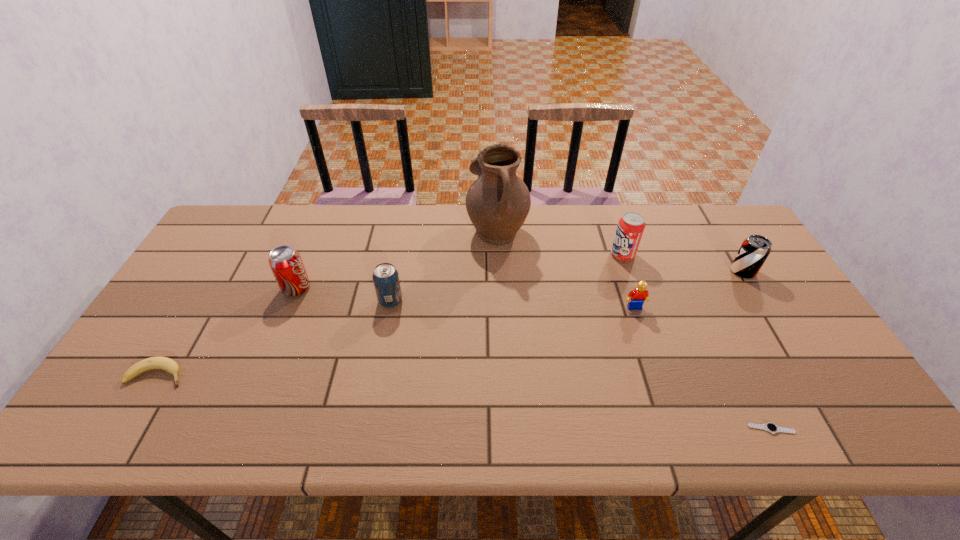
Locate an element on the screen. the shortest object is located at coordinates (770, 427).

Locate an element on the screen. The height and width of the screenshot is (540, 960). free space located 0.130m at the spout of the tallest object is located at coordinates (428, 228).

You are a GUI agent. You are given a task and a screenshot of the screen. Output one action in this format:
    pyautogui.click(x=<x>, y=<y>)
    Task: Click on the free space located at the spout of the tallest object
    This screenshot has width=960, height=540.
    Given the screenshot: What is the action you would take?
    pyautogui.click(x=421, y=228)

The width and height of the screenshot is (960, 540). What are the coordinates of `vacant space located at the spout of the tallest object` in the screenshot? It's located at (365, 228).

Locate an element on the screen. Image resolution: width=960 pixels, height=540 pixels. vacant area situated 0.070m on the surface of the second soda can from right to left is located at coordinates (588, 255).

Identify the location of free region located on the surface of the second soda can from right to left. (588, 255).

Locate an element on the screen. free region located 0.160m on the surface of the second soda can from right to left is located at coordinates (560, 255).

At what (x,y) coordinates should I click in order to perform the action: click on free space located on the back of the leftmost soda can. Please return your answer as a coordinate pair (x, y). This screenshot has height=540, width=960. Looking at the image, I should click on (313, 247).

Locate an element on the screen. The image size is (960, 540). free space located on the back of the second soda can from left to right is located at coordinates (406, 219).

Identify the location of vacant area situated on the front of the rightmost object. (774, 322).